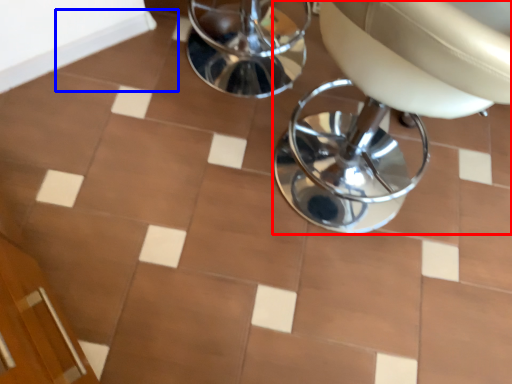
Question: Which object appears closest to the camera in this image, chair (highlighted by a red box) or ceramic tile (highlighted by a blue box)?

Choices:
 (A) chair
 (B) ceramic tile

Answer: (A)